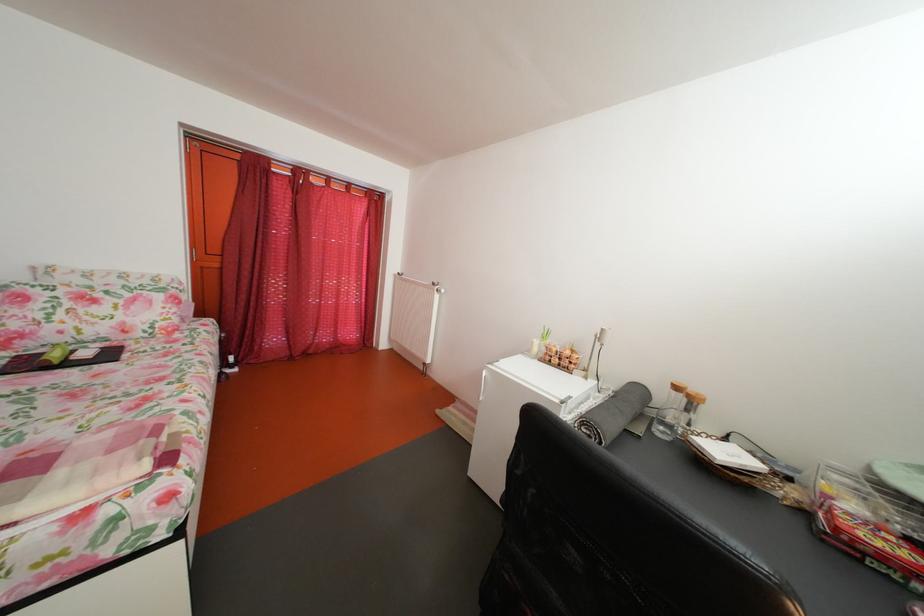
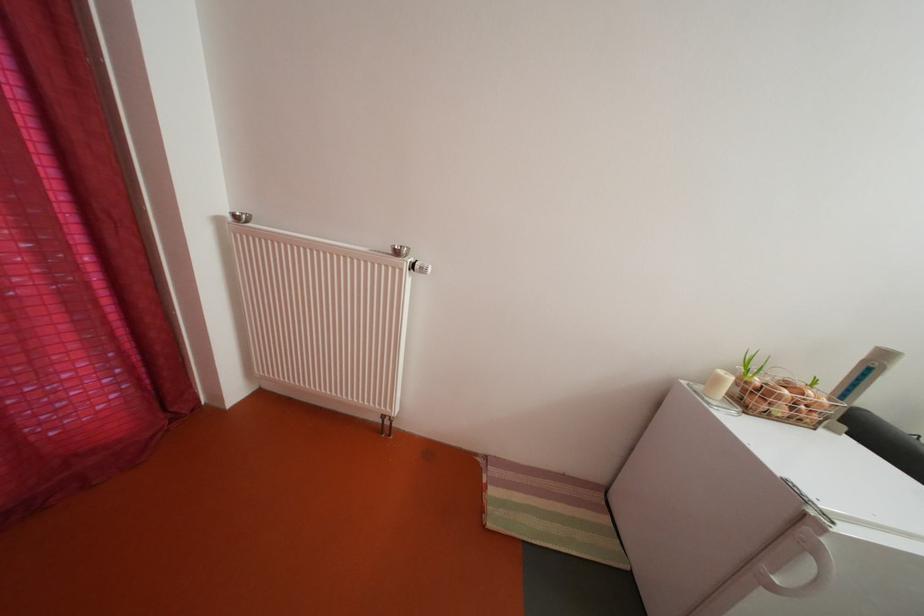
Locate, in the second image, the point that corresponds to (543,350) in the first image.

(728, 386)